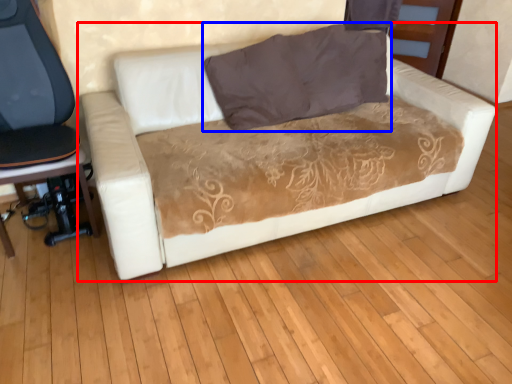
Question: Which object is further to the camera taking this photo, studio couch (highlighted by a red box) or pillow (highlighted by a blue box)?

Choices:
 (A) studio couch
 (B) pillow

Answer: (B)